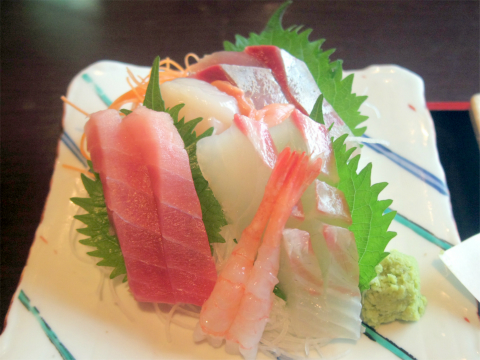
This screenshot has height=360, width=480. Identify the location of porcelain plate. (393, 142).